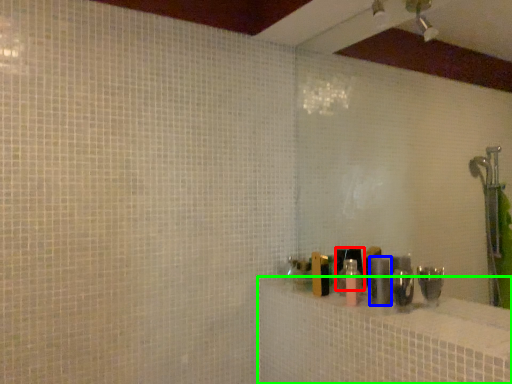
Question: Which object is the closest to the toiletry (highlighted by a red box)? Choose among these: toiletry (highlighted by a blue box) or bath (highlighted by a green box).

Choices:
 (A) toiletry
 (B) bath

Answer: (A)